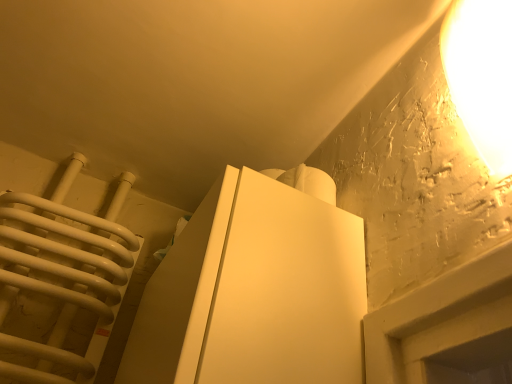
The width and height of the screenshot is (512, 384). Find the location of `white matte cabinet at center`. white matte cabinet at center is located at coordinates (254, 292).

The height and width of the screenshot is (384, 512). Describe the element at coordinates (254, 292) in the screenshot. I see `white matte cabinet at center` at that location.

Describe the element at coordinates (481, 75) in the screenshot. I see `matte white lampshade at upper right` at that location.

Where is `matte white lampshade at upper right`? matte white lampshade at upper right is located at coordinates (481, 75).

What is the approximate height of matte white lampshade at upper right?

matte white lampshade at upper right is 13.65 inches in height.

Locate an element on the screen. The image size is (512, 384). white matte cabinet at center is located at coordinates (254, 292).

Considering the relative positions of matte white lampshade at upper right and white matte cabinet at center in the image provided, is matte white lampshade at upper right to the left of white matte cabinet at center from the viewer's perspective?

No.

Is the depth of matte white lampshade at upper right greater than that of white matte cabinet at center?

No, the depth of matte white lampshade at upper right is less than that of white matte cabinet at center.

Does point (459, 106) appear closer or farther from the camera than point (214, 270)?

Point (459, 106) is positioned farther from the camera compared to point (214, 270).

From the image's perspective, is matte white lampshade at upper right above white matte cabinet at center?

Yes, from the image's perspective, matte white lampshade at upper right is over white matte cabinet at center.

From a real-world perspective, does matte white lampshade at upper right stand above white matte cabinet at center?

Correct, in the physical world, matte white lampshade at upper right is higher than white matte cabinet at center.

In terms of width, does matte white lampshade at upper right look wider or thinner when compared to white matte cabinet at center?

Considering their sizes, matte white lampshade at upper right looks slimmer than white matte cabinet at center.

Does matte white lampshade at upper right have a lesser height compared to white matte cabinet at center?

In fact, matte white lampshade at upper right may be taller than white matte cabinet at center.

Considering the sizes of objects matte white lampshade at upper right and white matte cabinet at center in the image provided, who is smaller, matte white lampshade at upper right or white matte cabinet at center?

Smaller between the two is matte white lampshade at upper right.

Would you say matte white lampshade at upper right is outside white matte cabinet at center?

Yes, matte white lampshade at upper right is located beyond the bounds of white matte cabinet at center.

Is matte white lampshade at upper right touching white matte cabinet at center?

No, matte white lampshade at upper right is not making contact with white matte cabinet at center.

Is white matte cabinet at center at the back of matte white lampshade at upper right?

No.

Image resolution: width=512 pixels, height=384 pixels. I want to click on furniture below the matte white lampshade at upper right (from the image's perspective), so click(254, 292).

Is white matte cabinet at center to the left of matte white lampshade at upper right from the viewer's perspective?

Yes.

Relative to matte white lampshade at upper right, is white matte cabinet at center in front or behind?

white matte cabinet at center is positioned farther from the viewer than matte white lampshade at upper right.

Is point (260, 261) in front of point (500, 134)?

That is False.

From the image's perspective, is white matte cabinet at center above or below matte white lampshade at upper right?

Clearly, from the image's perspective, white matte cabinet at center is below matte white lampshade at upper right.

From a real-world perspective, is white matte cabinet at center below matte white lampshade at upper right?

Indeed, from a real-world perspective, white matte cabinet at center is positioned beneath matte white lampshade at upper right.

Which of these two, white matte cabinet at center or matte white lampshade at upper right, is thinner?

With smaller width is matte white lampshade at upper right.

Is white matte cabinet at center shorter than matte white lampshade at upper right?

Yes.

Does white matte cabinet at center have a larger size compared to matte white lampshade at upper right?

Yes, white matte cabinet at center is bigger than matte white lampshade at upper right.

Is white matte cabinet at center positioned beyond the bounds of matte white lampshade at upper right?

Indeed, white matte cabinet at center is completely outside matte white lampshade at upper right.

Does white matte cabinet at center touch matte white lampshade at upper right?

No, white matte cabinet at center is not in contact with matte white lampshade at upper right.

Is matte white lampshade at upper right at the back of white matte cabinet at center?

white matte cabinet at center is not turned away from matte white lampshade at upper right.

The width and height of the screenshot is (512, 384). Identify the location of lamp above the white matte cabinet at center (from the image's perspective). (481, 75).

At what (x,y) coordinates should I click in order to perform the action: click on lamp that is on the right side of white matte cabinet at center. Please return your answer as a coordinate pair (x, y). This screenshot has height=384, width=512. Looking at the image, I should click on (481, 75).

This screenshot has width=512, height=384. What are the coordinates of `furniture behind the matte white lampshade at upper right` in the screenshot? It's located at (254, 292).